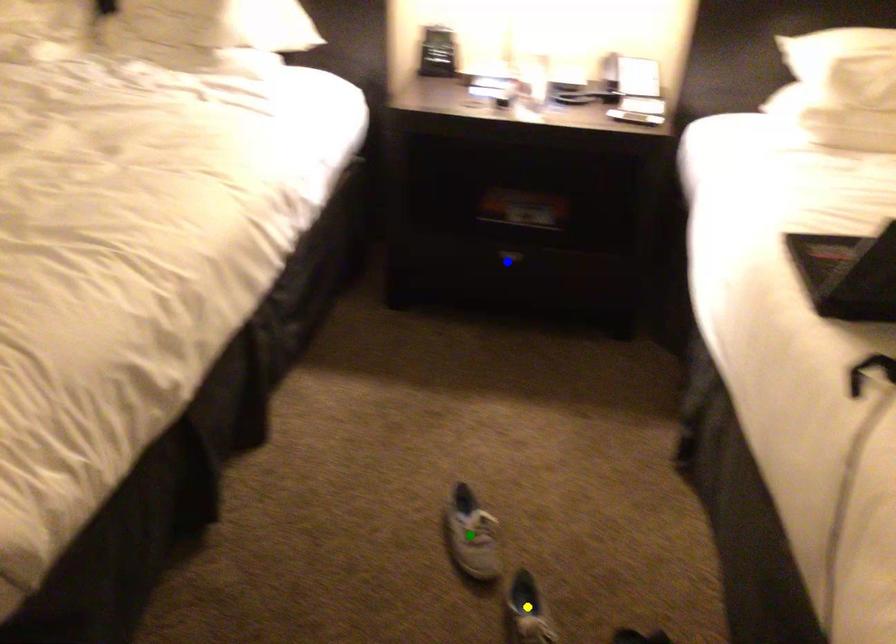
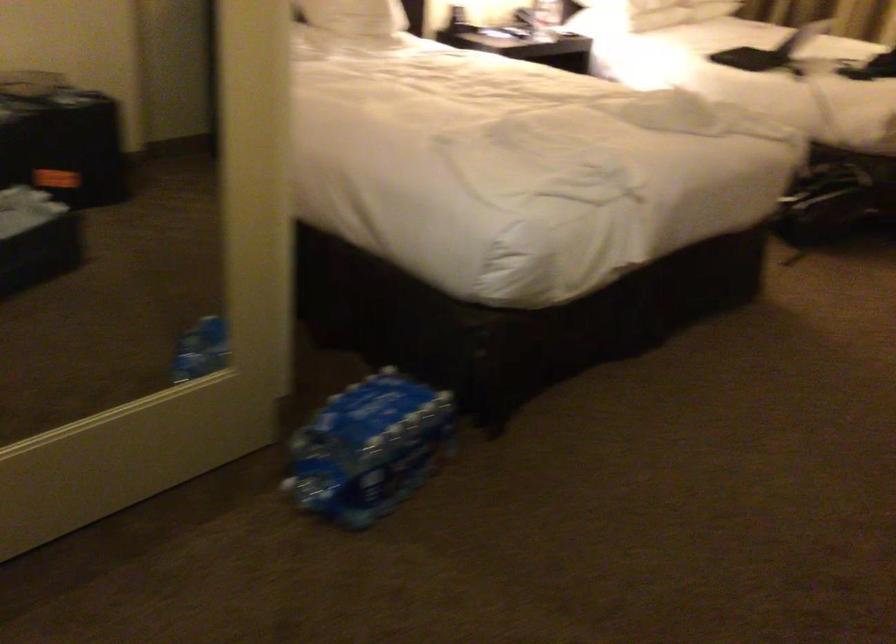
I am providing you with two images of the same scene from different viewpoints. Three points are marked in image1. Which point corresponds to a part or object that is occluded in image2?In image1, three points are marked. Which of them correspond to a part or object that is occluded in image2?Among the three points shown in image1, which one corresponds to a part or object that is no longer visible due to occlusion in image2?

Invisible in image2: green point, blue point, yellow point.